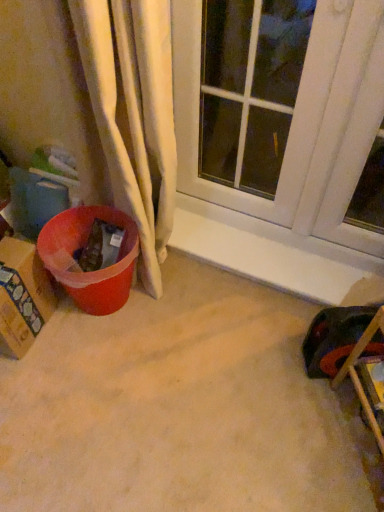
The image size is (384, 512). What are the coordinates of `free area in between wooden chair at lower right and cardboard box at left` in the screenshot? It's located at (198, 391).